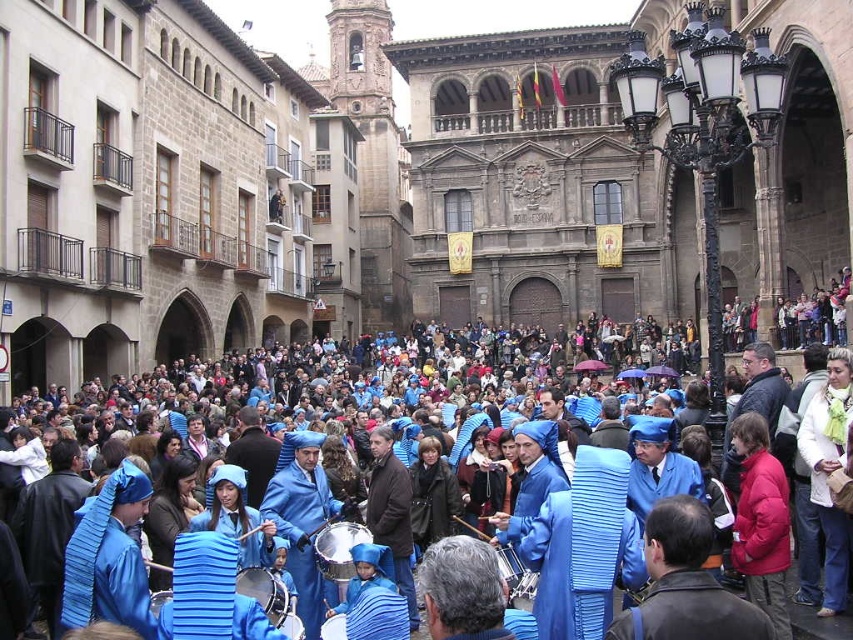
Question: Among these objects, which one is farthest from the camera?

Choices:
 (A) blue striped fabric at center
 (B) shiny silver drum at center

Answer: (B)

Question: Which of the following is the closest to the observer?

Choices:
 (A) shiny silver drum at center
 (B) blue striped fabric at center
 (C) metallic drum at center

Answer: (B)

Question: Is shiny silver drum at center positioned in front of metallic drum at center?

Choices:
 (A) no
 (B) yes

Answer: (A)

Question: Is blue striped fabric at center above metallic drum at center?

Choices:
 (A) yes
 (B) no

Answer: (A)

Question: Which is nearer to the shiny silver drum at center?

Choices:
 (A) metallic drum at center
 (B) blue striped fabric at center

Answer: (A)

Question: Can you confirm if shiny silver drum at center is wider than metallic drum at center?

Choices:
 (A) yes
 (B) no

Answer: (B)